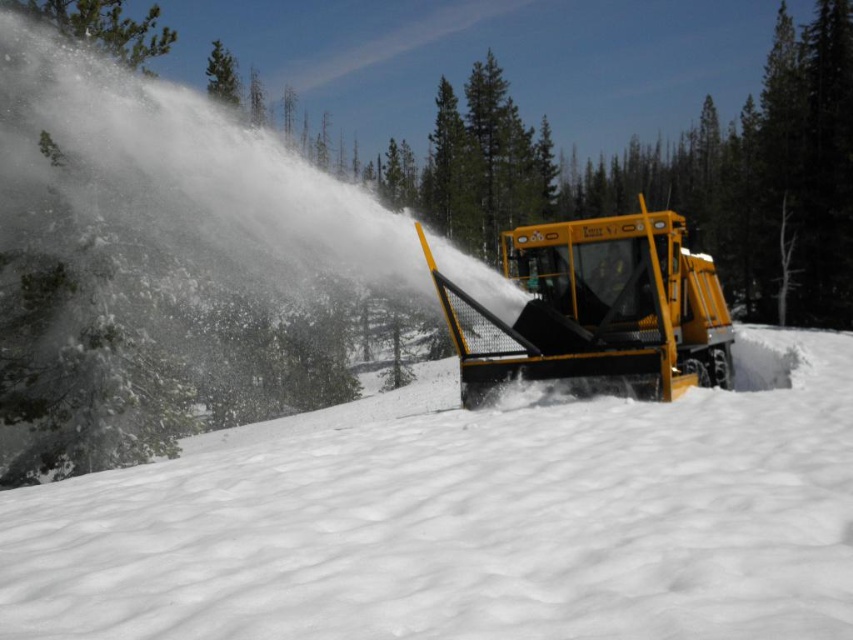
You are standing at the point marked as point (468, 518). What is the material at your feet?

The material at your feet at point (468, 518) is white powdery snow at center.

You are standing at the center of the snowy slope and want to reach the snowplow at center right. Which direction should you move to avoid the white powdery snow at center?

The white powdery snow at center is located at point (468,518). Since you are at the center, moving towards the snowplow at center right would require moving to the right, away from the snow at center.

You are standing on the slope and see the yellow metallic snowplow at center and the white powdery snow at center. Which object is closer to the ground?

The white powdery snow at center is located below the yellow metallic snowplow at center, so it is closer to the ground.